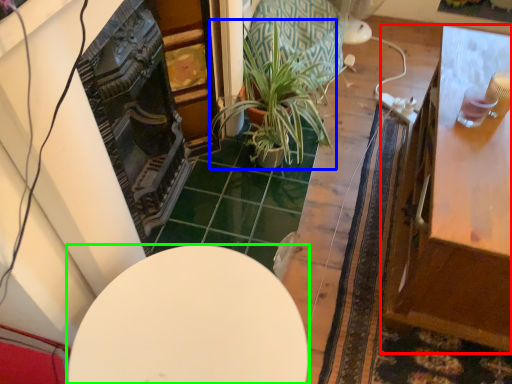
Question: Estimate the real-world distances between objects in this image. Which object is closer to table (highlighted by a red box), houseplant (highlighted by a blue box) or table (highlighted by a green box)?

Choices:
 (A) houseplant
 (B) table

Answer: (B)